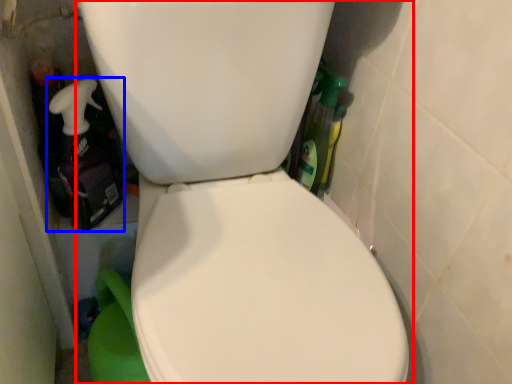
Question: Which object is closer to the camera taking this photo, toilet (highlighted by a red box) or cleaning product (highlighted by a blue box)?

Choices:
 (A) toilet
 (B) cleaning product

Answer: (A)